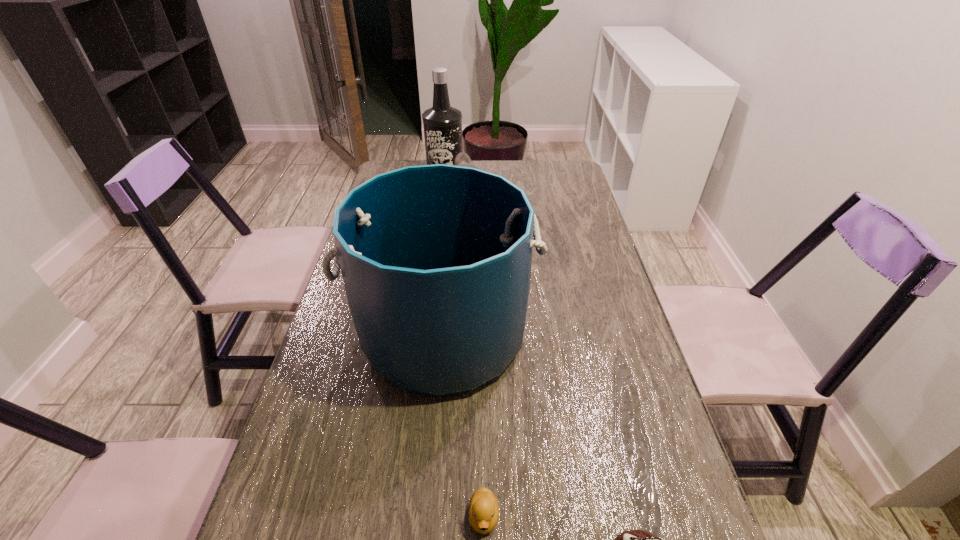
Image resolution: width=960 pixels, height=540 pixels. In the image, there is a desktop. Find the location of `vacant space at the right edge`. vacant space at the right edge is located at coordinates (547, 195).

The image size is (960, 540). Find the location of `vacant space at the far right corner of the desktop`. vacant space at the far right corner of the desktop is located at coordinates (554, 169).

Identify which object is the third nearest to the second farthest object. Please provide its 2D coordinates. Your answer should be formatted as a tuple, i.e. [(x, y)], where the tuple contains the x and y coordinates of a point satisfying the conditions above.

[(483, 512)]

Where is `object that ranks as the closest to the third tallest object`? object that ranks as the closest to the third tallest object is located at coordinates (442, 123).

You are a GUI agent. You are given a task and a screenshot of the screen. Output one action in this format:
    pyautogui.click(x=<x>, y=<y>)
    Task: Click on the free space that satisfies the following two spatial constraints: 1. on the front label of the farthest object; 2. on the left side of the third nearest object
    
    Given the screenshot: What is the action you would take?
    [424, 334]